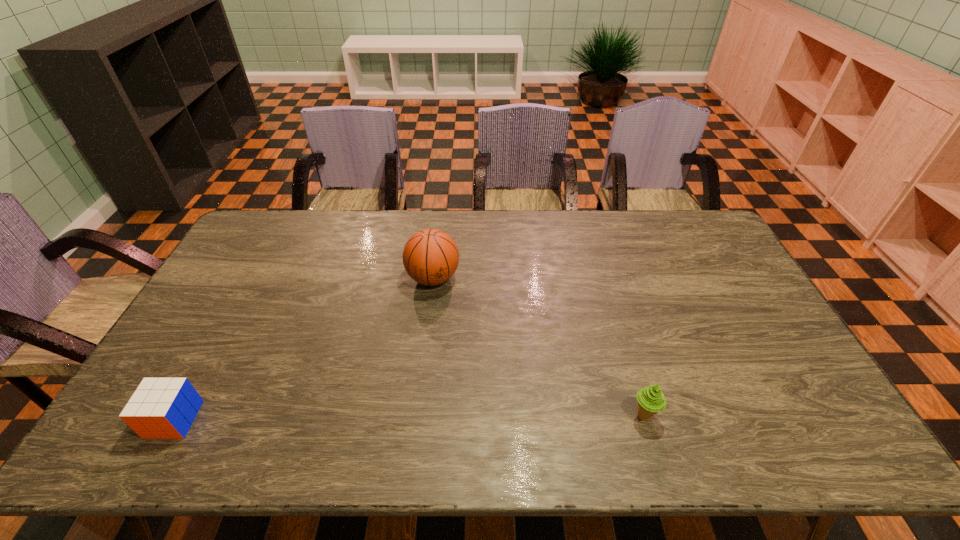
You are a GUI agent. You are given a task and a screenshot of the screen. Output one action in this format:
    pyautogui.click(x=<x>, y=<y>)
    Task: Click on the free space that is in between the leftmost object and the second object from right to left
    This screenshot has width=960, height=540.
    Given the screenshot: What is the action you would take?
    pyautogui.click(x=303, y=349)

Where is `free area in between the cube and the second object from left to right`? free area in between the cube and the second object from left to right is located at coordinates (303, 349).

Image resolution: width=960 pixels, height=540 pixels. In order to click on free spot between the leftmost object and the rightmost object in this screenshot , I will do `click(409, 417)`.

At what (x,y) coordinates should I click in order to perform the action: click on empty location between the farthest object and the second tallest object. Please return your answer as a coordinate pair (x, y). Looking at the image, I should click on (539, 347).

You are a GUI agent. You are given a task and a screenshot of the screen. Output one action in this format:
    pyautogui.click(x=<x>, y=<y>)
    Task: Click on the free space between the shortest object and the rightmost object
    The image size is (960, 540).
    Given the screenshot: What is the action you would take?
    pyautogui.click(x=409, y=417)

You are a GUI agent. You are given a task and a screenshot of the screen. Output one action in this format:
    pyautogui.click(x=<x>, y=<y>)
    Task: Click on the vacant space in between the farthest object and the cube
    The height and width of the screenshot is (540, 960).
    Given the screenshot: What is the action you would take?
    pyautogui.click(x=303, y=349)

Identify the location of vacant region between the cube and the rightmost object. The image size is (960, 540). (409, 417).

The width and height of the screenshot is (960, 540). What are the coordinates of `free space between the rightmost object and the second object from left to right` in the screenshot? It's located at (539, 347).

I want to click on the closest object relative to the leftmost object, so click(x=430, y=256).

The image size is (960, 540). Identify the location of the second closest object to the basketball. (161, 408).